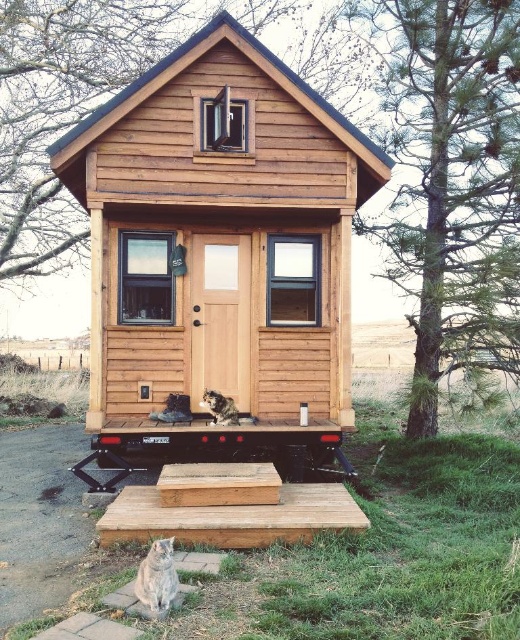
Question: Considering the relative positions of fuzzy brown cat at center and black rubber wheel at lower center in the image provided, where is fuzzy brown cat at center located with respect to black rubber wheel at lower center?

Choices:
 (A) below
 (B) above

Answer: (B)

Question: Can you confirm if fuzzy brown cat at center is thinner than black rubber wheel at lower center?

Choices:
 (A) no
 (B) yes

Answer: (A)

Question: Which point appears closest to the camera in this image?

Choices:
 (A) (174, 586)
 (B) (210, 406)
 (C) (95, 422)
 (D) (100, 461)

Answer: (A)

Question: Is fuzzy brown cat at center below black rubber wheel at lower center?

Choices:
 (A) yes
 (B) no

Answer: (B)

Question: Which point is farther from the camera taking this photo?

Choices:
 (A) (98, 452)
 (B) (219, 417)
 (C) (131, 426)

Answer: (B)

Question: Which point is farther to the camera?

Choices:
 (A) wooden cabin at center
 (B) gray fur cat at lower left

Answer: (A)